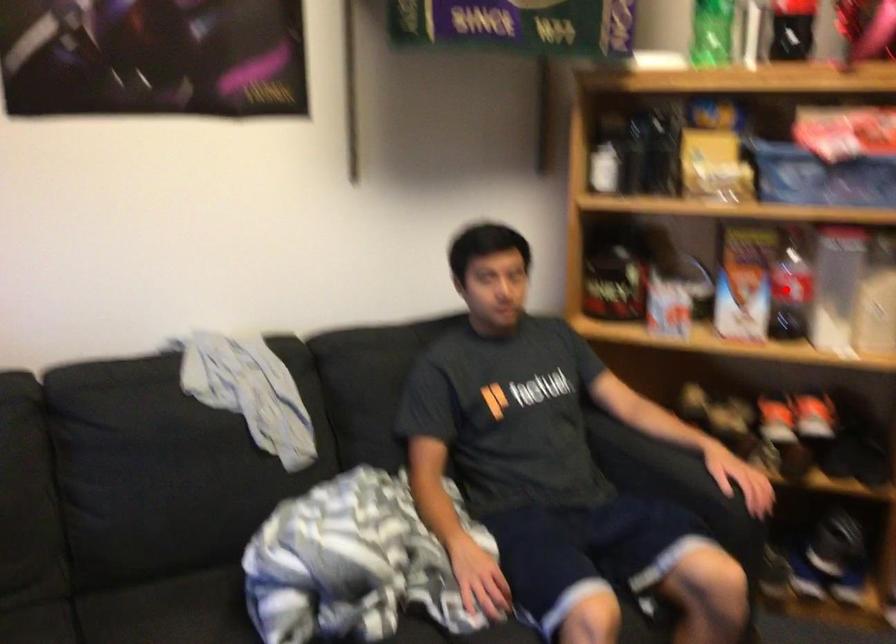
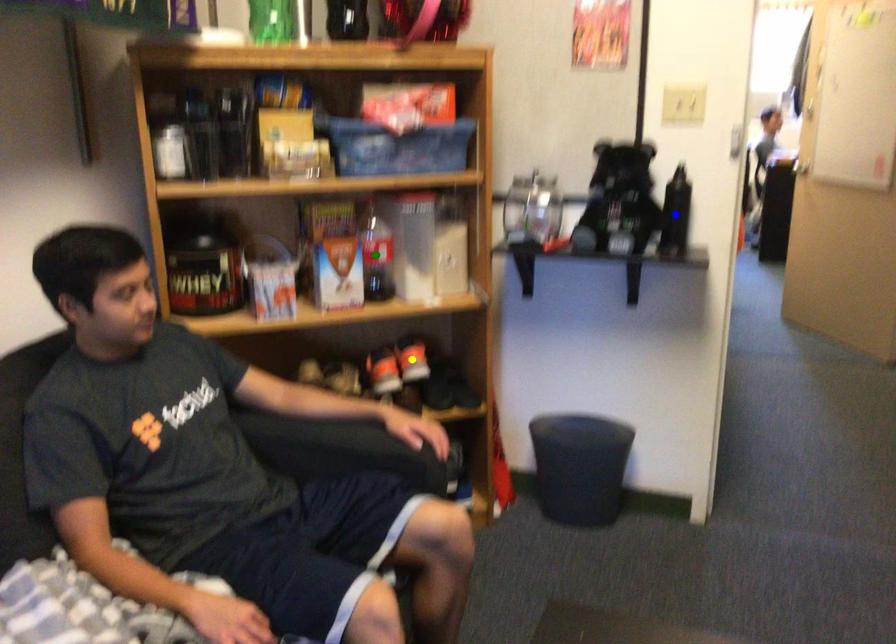
Question: I am providing you with two images of the same scene from different viewpoints. A red point is marked on the first image. You are given multiple points on the second image. Which point in image 2 is actually the same real-world point as the red point in image 1?

Choices:
 (A) yellow point
 (B) blue point
 (C) green point

Answer: (C)